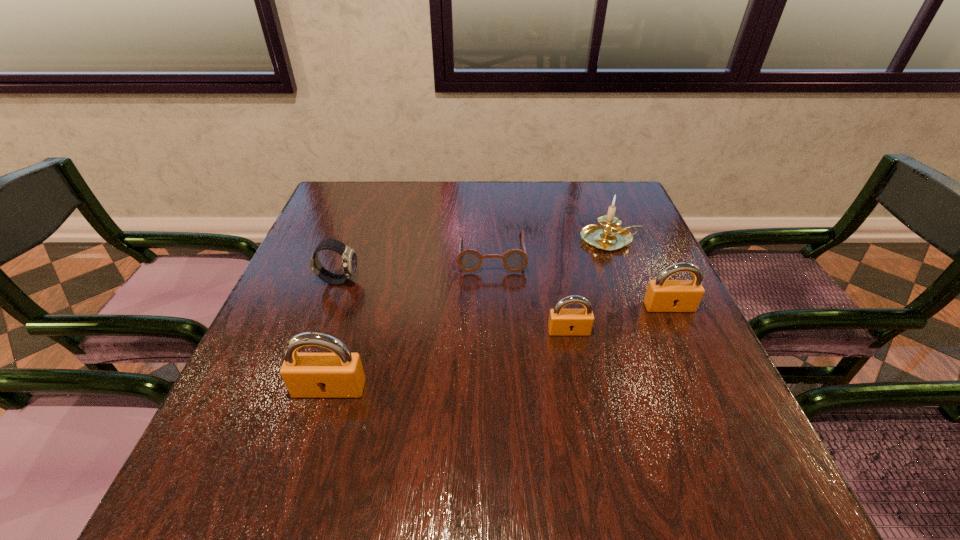
Locate an element on the screen. This screenshot has height=540, width=960. object positioned at the near left corner is located at coordinates (340, 374).

The width and height of the screenshot is (960, 540). I want to click on vacant point at the far edge, so click(x=393, y=225).

Find the location of a particular element. The image size is (960, 540). vacant space at the near edge is located at coordinates (358, 409).

Image resolution: width=960 pixels, height=540 pixels. I want to click on blank space at the left edge of the desktop, so click(313, 318).

Identify the location of free space at the right edge of the desktop. pos(635,302).

The width and height of the screenshot is (960, 540). Find the location of `vacant space at the far right corner of the desktop`. vacant space at the far right corner of the desktop is located at coordinates (633, 198).

Find the location of a particular element. free space between the tallest padlock and the farthest padlock is located at coordinates (499, 348).

Where is `vacant area that lies between the second nearest padlock and the tallest padlock`? vacant area that lies between the second nearest padlock and the tallest padlock is located at coordinates (449, 360).

Image resolution: width=960 pixels, height=540 pixels. What are the coordinates of `unoccupied area between the second padlock from right to left and the rightmost padlock` in the screenshot? It's located at (619, 319).

Find the location of a particular element. Image resolution: width=960 pixels, height=540 pixels. free spot between the watch and the leftmost padlock is located at coordinates (334, 334).